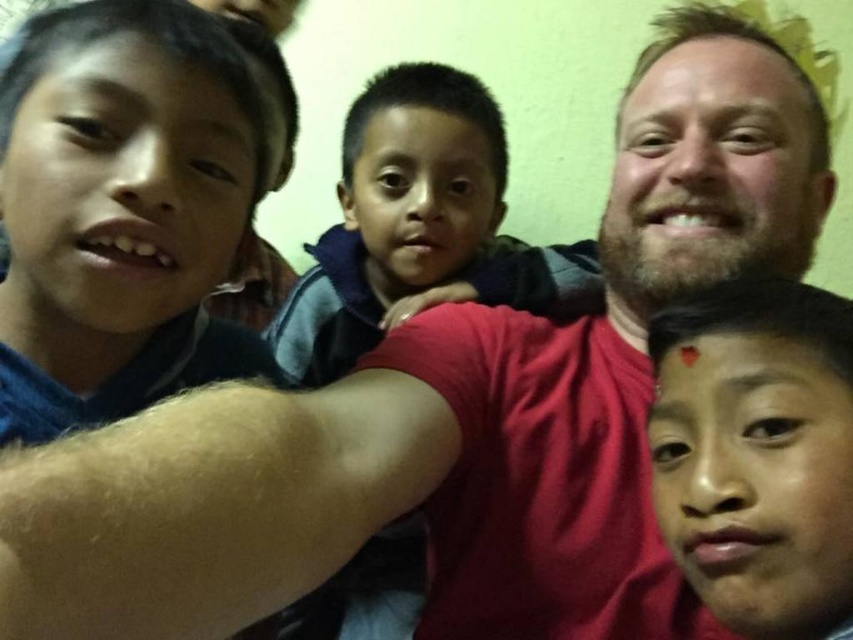
You are trying to identify who is in the group selfie. The person with the matte skin face at lower right claims they are in front of the dark blue fleece at center. Is their claim correct?

The matte skin face at lower right is behind the dark blue fleece at center, so their claim is incorrect.

Based on the scene description, where is the dark blue fleece at center located in terms of coordinates?

The dark blue fleece at center is located at coordinates point [419,227].